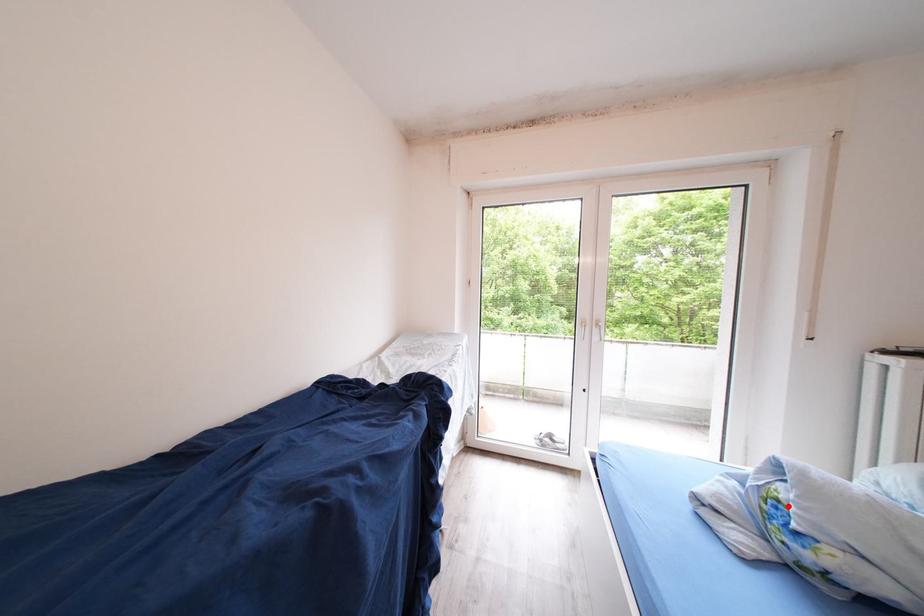
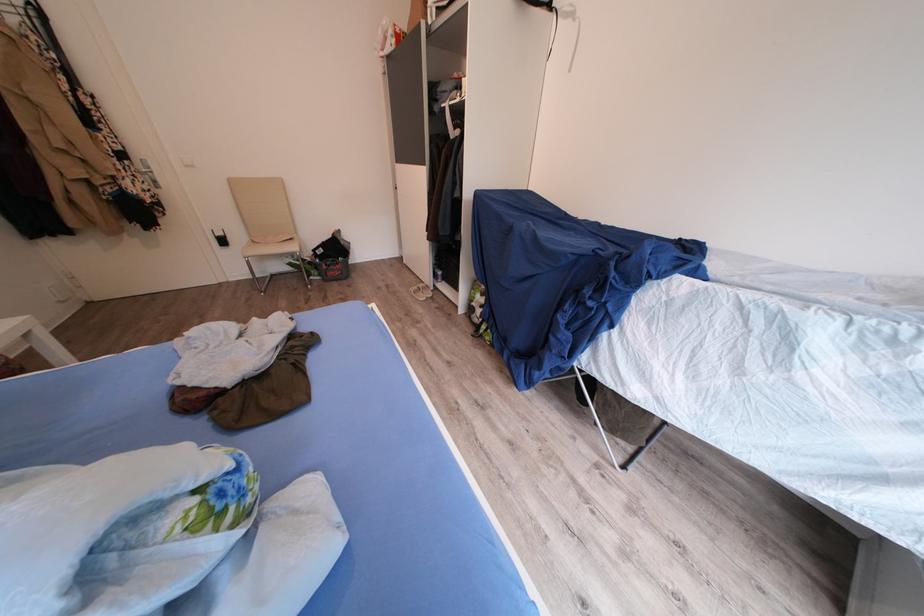
Locate, in the second image, the point that corresponds to the highlighted location in the first image.

(213, 507)